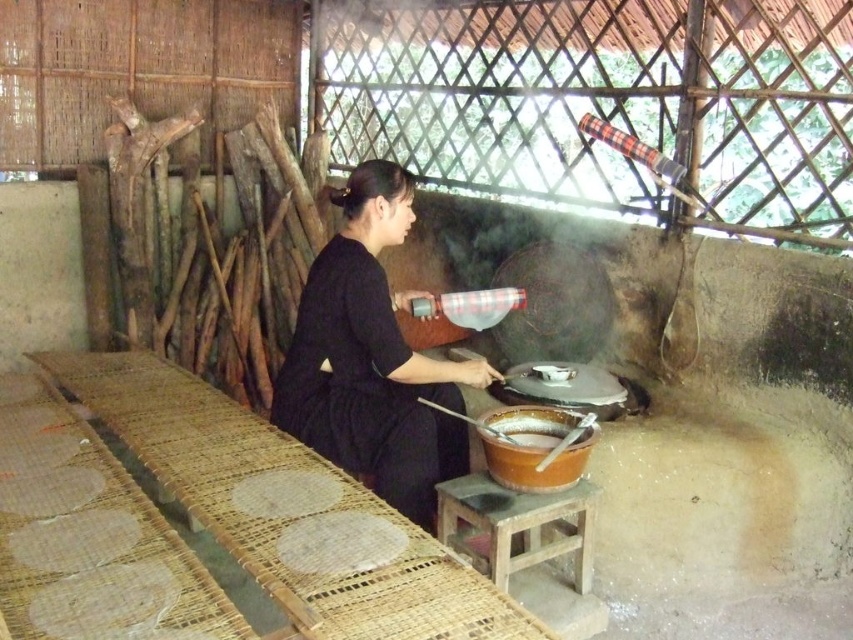
You are a chef preparing to cook in this rustic outdoor kitchen. You need to place a new ingredient on the wooden stool at center and the brown matte wok at center. Which object should you place it on if you want it closer to you?

You should place the ingredient on the wooden stool at center because it is closer to you than the brown matte wok at center.

You are a chef in a traditional kitchen and you need to move the brown matte wok at center to the right side of the table. However, there is a black matte dress at center in the way. Can you move the wok without moving the dress?

The black matte dress at center is located above the brown matte wok at center, so you cannot move the wok without moving the dress first.

You are a chef preparing to cook. You have a wooden stool at center and a brown matte wok at center. Which object is bigger?

The wooden stool at center is larger in size compared to the brown matte wok at center.